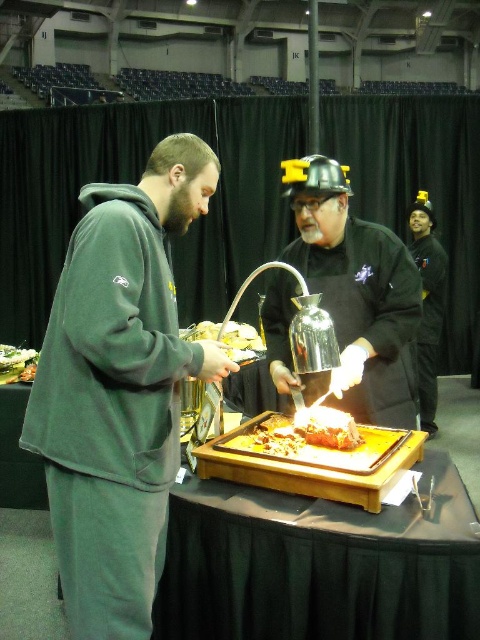
I want to click on shiny silver helmet at center, so click(x=357, y=291).

Who is more distant from viewer, (385, 243) or (20, 356)?

Point (20, 356)

Who is more distant from viewer, [397,336] or [12,348]?

The point [12,348] is more distant.

You are a GUI agent. You are given a task and a screenshot of the screen. Output one action in this format:
    pyautogui.click(x=<x>, y=<y>)
    Task: Click on the shiny silver helmet at center
    The width and height of the screenshot is (480, 640).
    Given the screenshot: What is the action you would take?
    pyautogui.click(x=357, y=291)

From the picture: Between dark green hoodie at left and white fluffy bread at center, which one appears on the left side from the viewer's perspective?

dark green hoodie at left

Is dark green hoodie at left bigger than white fluffy bread at center?

Yes.

Where is `dark green hoodie at left`? This screenshot has height=640, width=480. dark green hoodie at left is located at coordinates (119, 388).

Does shiny silver helmet at center appear on the left side of white fluffy bread at center?

Incorrect, shiny silver helmet at center is not on the left side of white fluffy bread at center.

What do you see at coordinates (357, 291) in the screenshot?
I see `shiny silver helmet at center` at bounding box center [357, 291].

Identify the location of shiny silver helmet at center. This screenshot has width=480, height=640. (357, 291).